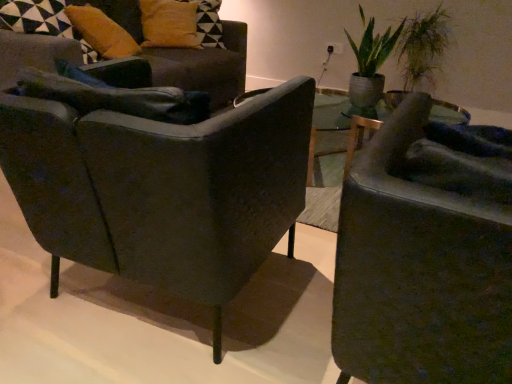
Question: Is green leafy plant at upper right surrounded by matte black armchair at left, the 1th chair in the back-to-front sequence?

Choices:
 (A) yes
 (B) no

Answer: (B)

Question: Can you see matte black armchair at left, the 1th chair in the back-to-front sequence, touching green leafy plant at upper right?

Choices:
 (A) yes
 (B) no

Answer: (B)

Question: Does matte black armchair at left, arranged as the 3th chair when viewed from the front, appear on the right side of green leafy plant at upper right?

Choices:
 (A) no
 (B) yes

Answer: (A)

Question: Does matte black armchair at left, the 1th chair in the back-to-front sequence, appear on the left side of green leafy plant at upper right?

Choices:
 (A) yes
 (B) no

Answer: (A)

Question: Can you confirm if matte black armchair at left, the 1th chair in the back-to-front sequence, is thinner than green leafy plant at upper right?

Choices:
 (A) yes
 (B) no

Answer: (B)

Question: Is point (343, 365) closer or farther from the camera than point (168, 41)?

Choices:
 (A) farther
 (B) closer

Answer: (B)

Question: Visually, is matte black armchair at right, the first chair positioned from the front, positioned to the left or to the right of matte yellow pillow at upper left, which is the second pillow from front to back?

Choices:
 (A) left
 (B) right

Answer: (B)

Question: Is matte black armchair at right, the first chair positioned from the front, taller or shorter than matte yellow pillow at upper left, which is the second pillow from front to back?

Choices:
 (A) short
 (B) tall

Answer: (B)

Question: Is matte black armchair at right, arranged as the 3th chair when viewed from the back, in front of or behind matte yellow pillow at upper left, which is the second pillow from front to back, in the image?

Choices:
 (A) front
 (B) behind

Answer: (A)

Question: Considering the positions of matte black armchair at left, the second chair from the front, and green leafy plant at upper right in the image, is matte black armchair at left, the second chair from the front, bigger or smaller than green leafy plant at upper right?

Choices:
 (A) small
 (B) big

Answer: (B)

Question: Is point (110, 152) closer or farther from the camera than point (352, 100)?

Choices:
 (A) closer
 (B) farther

Answer: (A)

Question: Looking at their shapes, would you say matte black armchair at left, acting as the 2th chair starting from the back, is wider or thinner than green leafy plant at upper right?

Choices:
 (A) thin
 (B) wide

Answer: (B)

Question: From their relative heights in the image, would you say matte black armchair at left, acting as the 2th chair starting from the back, is taller or shorter than green leafy plant at upper right?

Choices:
 (A) short
 (B) tall

Answer: (B)

Question: Considering the positions of green leafy plant at upper right and matte black armchair at right, the first chair positioned from the front, in the image, is green leafy plant at upper right wider or thinner than matte black armchair at right, the first chair positioned from the front,?

Choices:
 (A) wide
 (B) thin

Answer: (B)

Question: From the image's perspective, is green leafy plant at upper right positioned above or below matte black armchair at right, arranged as the 3th chair when viewed from the back?

Choices:
 (A) above
 (B) below

Answer: (A)